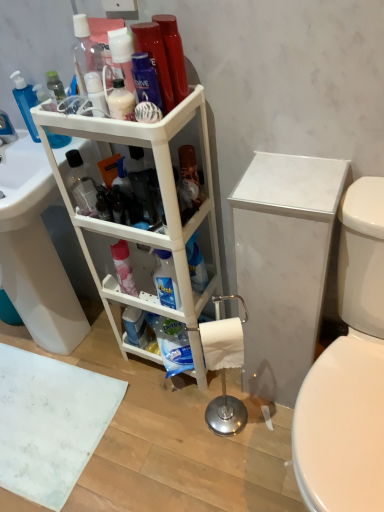
Question: Can you confirm if white marble cabinet at right is shorter than white plastic shelf at center?

Choices:
 (A) no
 (B) yes

Answer: (B)

Question: Would you say white plastic shelf at center is part of white marble cabinet at right's contents?

Choices:
 (A) no
 (B) yes

Answer: (A)

Question: Is white marble cabinet at right oriented away from white plastic shelf at center?

Choices:
 (A) no
 (B) yes

Answer: (A)

Question: From a real-world perspective, is white marble cabinet at right on white plastic shelf at center?

Choices:
 (A) yes
 (B) no

Answer: (B)

Question: Can you confirm if white marble cabinet at right is bigger than white plastic shelf at center?

Choices:
 (A) yes
 (B) no

Answer: (B)

Question: Considering the positions of white glossy sink at lower left and white plastic shelf at center in the image, is white glossy sink at lower left bigger or smaller than white plastic shelf at center?

Choices:
 (A) big
 (B) small

Answer: (A)

Question: From a real-world perspective, is white glossy sink at lower left above or below white plastic shelf at center?

Choices:
 (A) above
 (B) below

Answer: (B)

Question: Looking at their shapes, would you say white glossy sink at lower left is wider or thinner than white plastic shelf at center?

Choices:
 (A) thin
 (B) wide

Answer: (B)

Question: Considering their positions, is white glossy sink at lower left located in front of or behind white plastic shelf at center?

Choices:
 (A) front
 (B) behind

Answer: (B)

Question: Considering the positions of point (9, 138) and point (119, 287), is point (9, 138) closer or farther from the camera than point (119, 287)?

Choices:
 (A) closer
 (B) farther

Answer: (A)

Question: Considering the relative positions of brushed metal faucet at left and pink matte cleaning product at center, which ranks as the first cleaning product in right-to-left order, in the image provided, is brushed metal faucet at left to the left or to the right of pink matte cleaning product at center, which ranks as the first cleaning product in right-to-left order,?

Choices:
 (A) left
 (B) right

Answer: (A)

Question: In terms of size, does brushed metal faucet at left appear bigger or smaller than pink matte cleaning product at center, which ranks as the first cleaning product in bottom-to-top order?

Choices:
 (A) small
 (B) big

Answer: (B)

Question: Is brushed metal faucet at left spatially inside pink matte cleaning product at center, which ranks as the first cleaning product in bottom-to-top order, or outside of it?

Choices:
 (A) outside
 (B) inside

Answer: (A)

Question: Is white glossy sink at lower left bigger or smaller than translucent plastic pump bottle at upper left, the 1th cleaning product viewed from the left?

Choices:
 (A) big
 (B) small

Answer: (A)

Question: Is white glossy sink at lower left inside the boundaries of translucent plastic pump bottle at upper left, which appears as the first cleaning product when viewed from the top, or outside?

Choices:
 (A) inside
 (B) outside

Answer: (B)